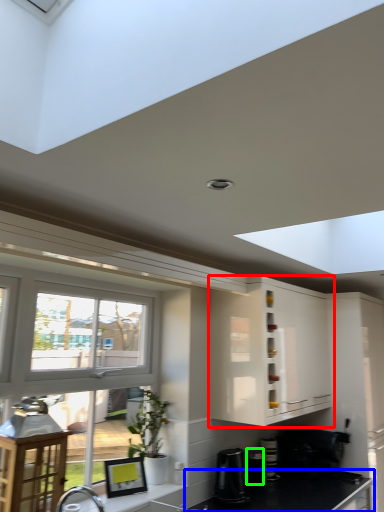
Question: Estimate the real-world distances between objects in this image. Which object is farther from cabinetry (highlighted by a red box), countertop (highlighted by a blue box) or appliance (highlighted by a green box)?

Choices:
 (A) countertop
 (B) appliance

Answer: (B)